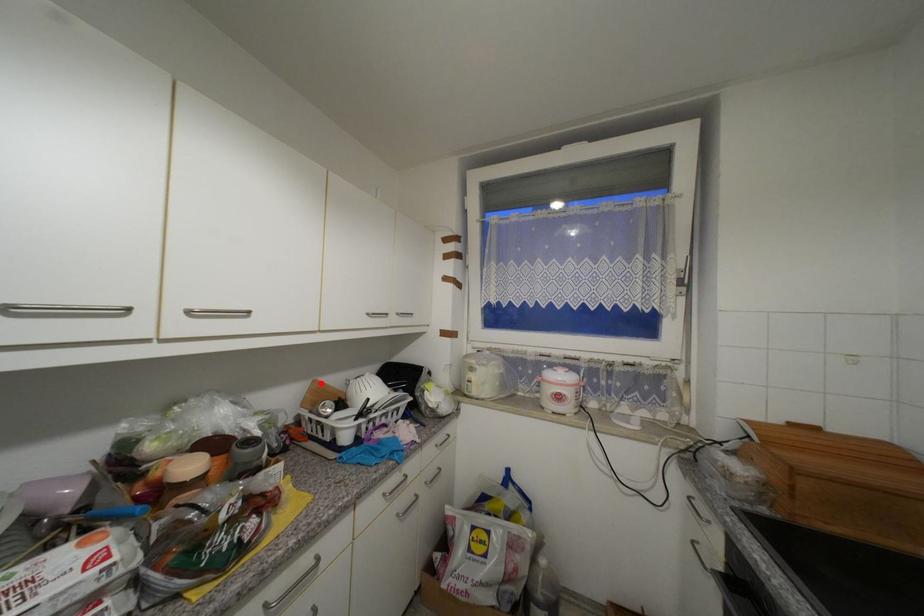
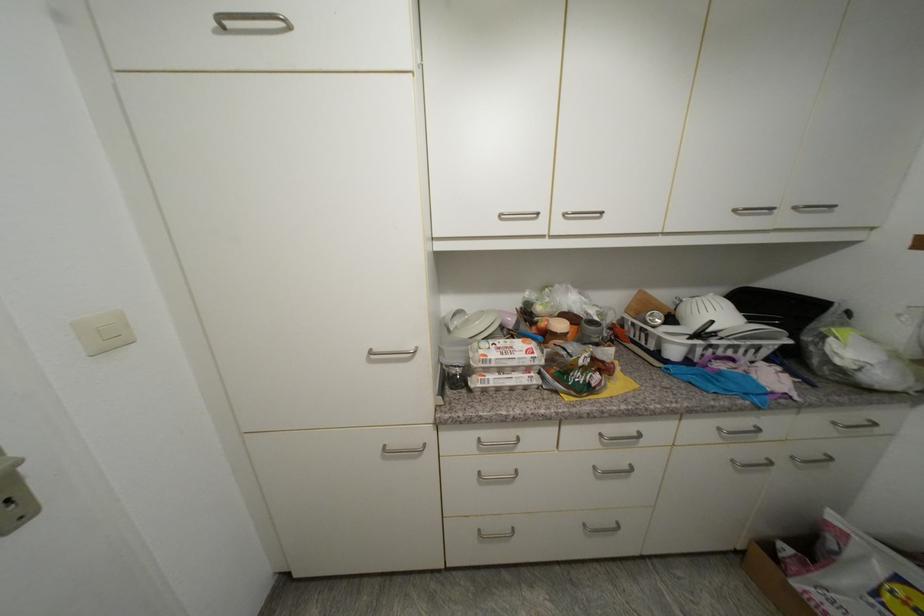
The point at the highlighted location is marked in the first image. Where is the corresponding point in the second image?

(647, 294)